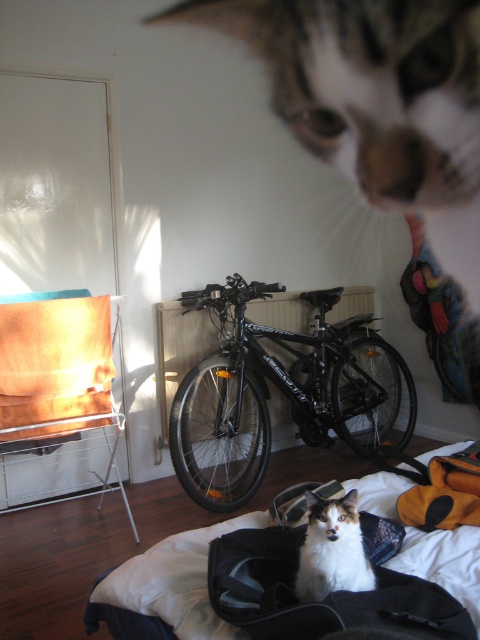
Question: Which object is closer to the camera taking this photo?

Choices:
 (A) calico fur cat at center
 (B) black matte bicycle at center
 (C) white soft bed at center
 (D) soft black fabric bag at lower center

Answer: (D)

Question: Does soft black fabric bag at lower center have a greater width compared to white soft bed at center?

Choices:
 (A) no
 (B) yes

Answer: (A)

Question: Can you confirm if white soft bed at center is positioned above calico fur cat at center?

Choices:
 (A) yes
 (B) no

Answer: (B)

Question: Which object appears farthest from the camera in this image?

Choices:
 (A) white soft bed at center
 (B) soft black fabric bag at lower center

Answer: (A)

Question: Observing the image, what is the correct spatial positioning of soft black fabric bag at lower center in reference to calico fur cat at center?

Choices:
 (A) below
 (B) above

Answer: (A)

Question: Estimate the real-world distances between objects in this image. Which object is closer to the white soft bed at center?

Choices:
 (A) calico fur cat at center
 (B) soft black fabric bag at lower center

Answer: (B)